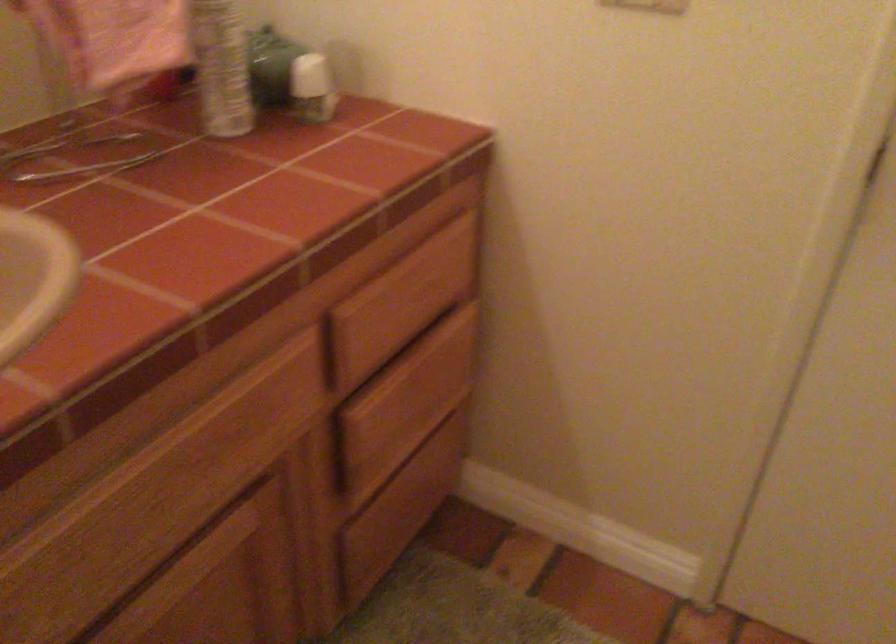
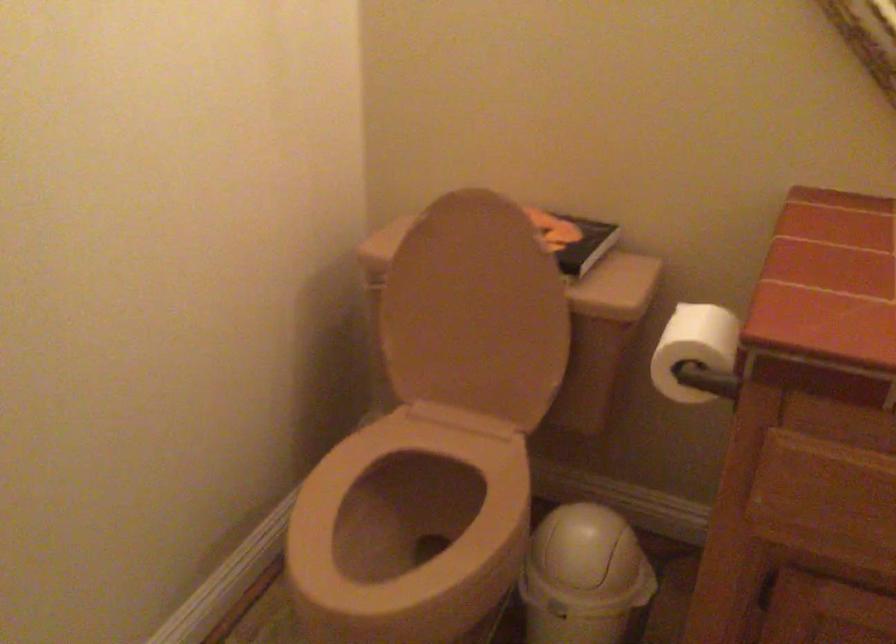
The first image is from the beginning of the video and the second image is from the end. How did the camera likely rotate when shooting the video?

The rotation direction of the camera is left-down.